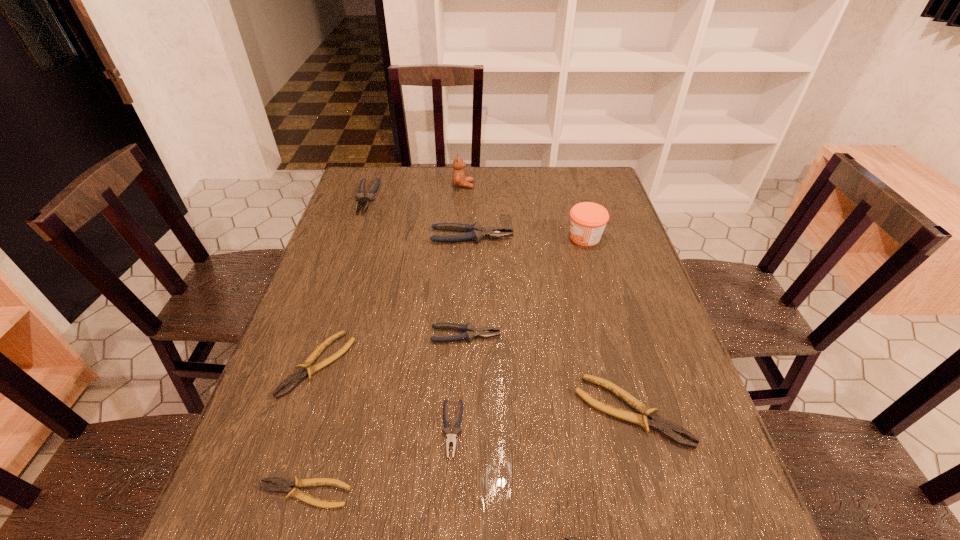
At what (x,y) coordinates should I click in order to perform the action: click on unoccupied area between the brown teddy bear and the third smallest yellow pliers. Please return your answer as a coordinate pair (x, y). Image resolution: width=960 pixels, height=540 pixels. Looking at the image, I should click on (391, 275).

Where is `vacant area that lies between the farthest pliers and the second biggest yellow pliers`? This screenshot has width=960, height=540. vacant area that lies between the farthest pliers and the second biggest yellow pliers is located at coordinates (342, 281).

Find the location of a particular element. Image resolution: width=960 pixels, height=540 pixels. vacant area that lies between the second nearest yellow pliers and the biggest gray pliers is located at coordinates (388, 364).

Identify the location of object that ranks as the eighth closest to the biggest yellow pliers. (459, 180).

This screenshot has height=540, width=960. I want to click on object that ranks as the fourth closest to the biggest yellow pliers, so click(283, 485).

The height and width of the screenshot is (540, 960). Identify the location of pliers identified as the sixth closest to the second nearest gray pliers. (568, 539).

In order to click on the seventh closest pliers relative to the biggest yellow pliers in this screenshot , I will do `click(370, 195)`.

Image resolution: width=960 pixels, height=540 pixels. What are the coordinates of `gray pliers that is the fourth nearest to the tallest object` in the screenshot? It's located at (451, 438).

Point out which gray pliers is positioned as the nearest to the smallest gray pliers. Please provide its 2D coordinates. Your answer should be formatted as a tuple, i.e. [(x, y)], where the tuple contains the x and y coordinates of a point satisfying the conditions above.

[(470, 332)]

Locate which yellow pliers ranks in proximity to the biggest yellow pliers. Please provide its 2D coordinates. Your answer should be formatted as a tuple, i.e. [(x, y)], where the tuple contains the x and y coordinates of a point satisfying the conditions above.

[(568, 539)]